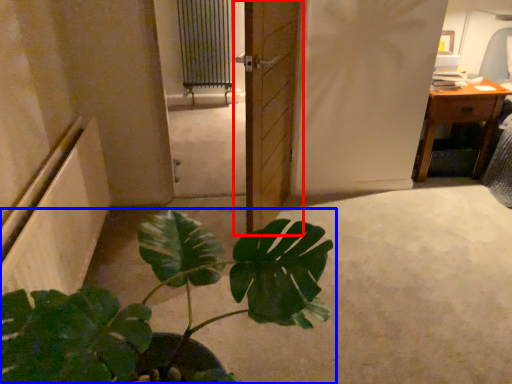
Question: Which object is further to the camera taking this photo, door (highlighted by a red box) or houseplant (highlighted by a blue box)?

Choices:
 (A) door
 (B) houseplant

Answer: (A)